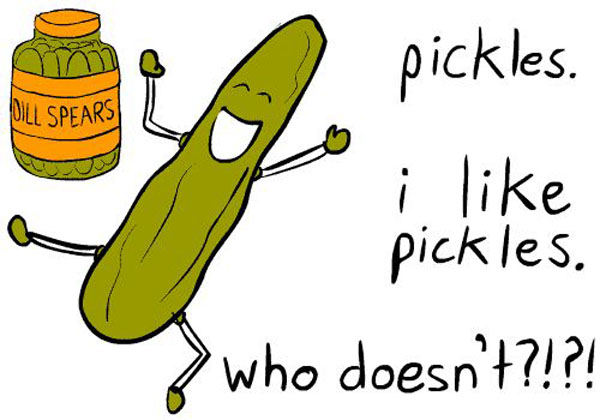
You are a GUI agent. You are given a task and a screenshot of the screen. Output one action in this format:
    pyautogui.click(x=<x>, y=<y>)
    Task: Click on the jar of pickles
    The image size is (600, 420).
    Given the screenshot: What is the action you would take?
    pyautogui.click(x=61, y=70)